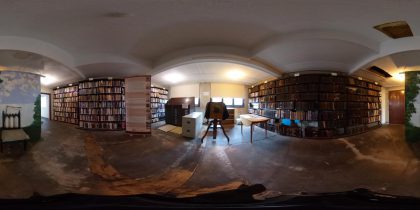
The image size is (420, 210). I want to click on table, so click(x=256, y=118).